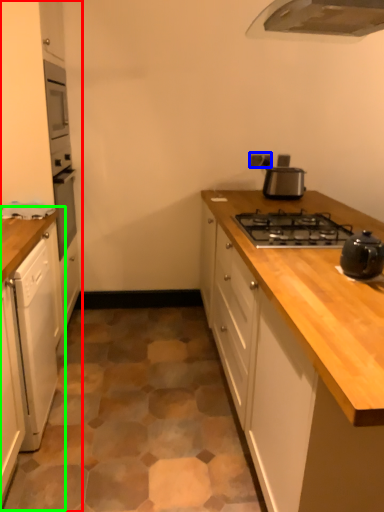
Question: Based on their relative distances, which object is farther from cabinetry (highlighted by a red box)? Choose from electric outlet (highlighted by a blue box) and cabinetry (highlighted by a green box).

Choices:
 (A) electric outlet
 (B) cabinetry

Answer: (A)